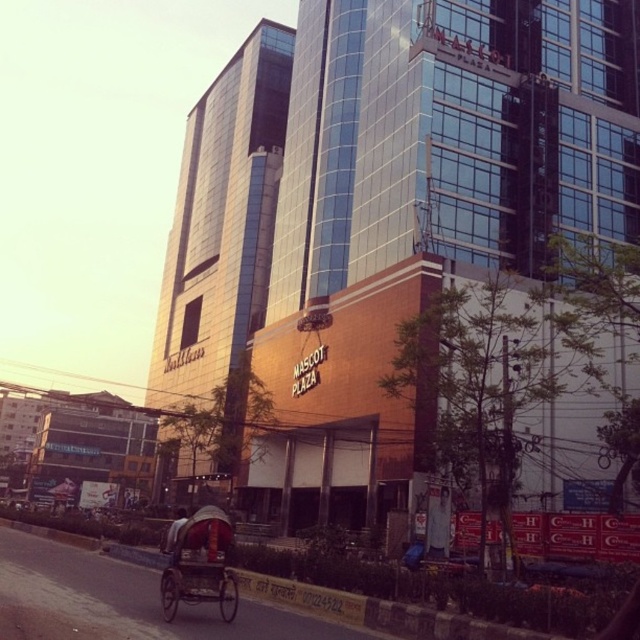
Who is more forward, (316, 26) or (161, 589)?

Point (161, 589) is more forward.

Can you confirm if glassy metallic building at center is positioned to the right of wooden rickshaw at lower left?

Yes, glassy metallic building at center is to the right of wooden rickshaw at lower left.

Describe the element at coordinates (381, 218) in the screenshot. I see `glassy metallic building at center` at that location.

Find the location of a particular element. glassy metallic building at center is located at coordinates (381, 218).